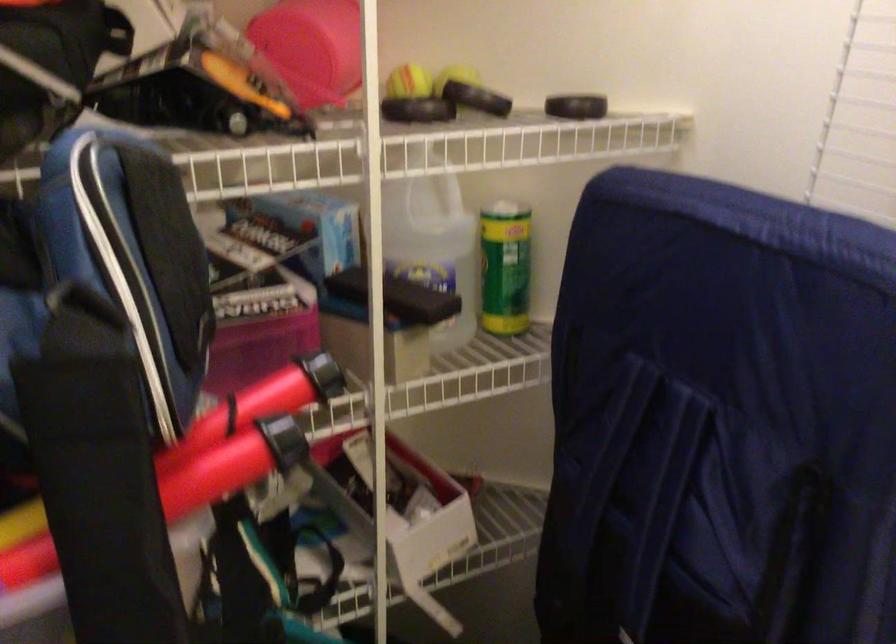
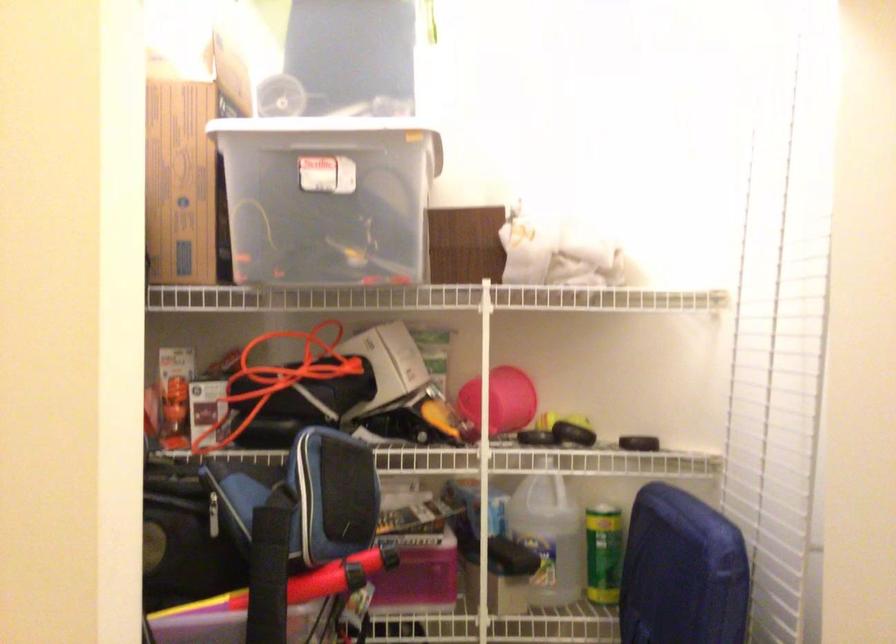
In the second image, find the point that corresponds to pixel 168 485 in the first image.

(298, 583)